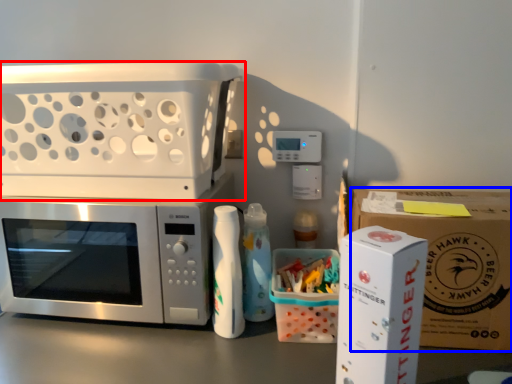
Question: Among these objects, which one is nearest to the camera, appliance (highlighted by a red box) or cardboard box (highlighted by a blue box)?

Choices:
 (A) appliance
 (B) cardboard box

Answer: (B)